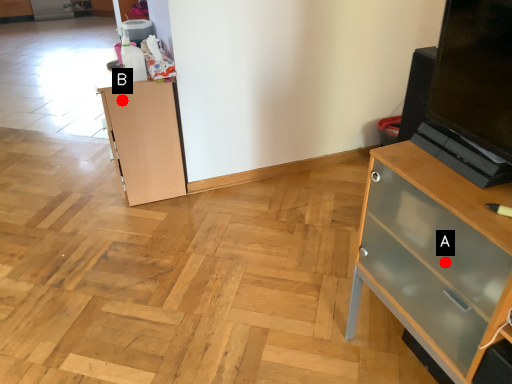
Question: Two points are circled on the image, labeled by A and B beside each circle. Which point is farther to the camera?

Choices:
 (A) A is further
 (B) B is further

Answer: (B)